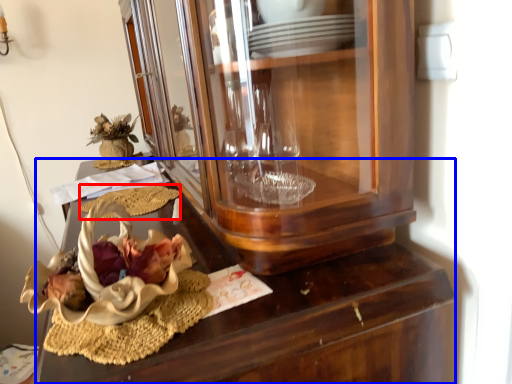
Question: Which object appears farthest to the camera in this image, food (highlighted by a red box) or desk (highlighted by a blue box)?

Choices:
 (A) food
 (B) desk

Answer: (A)